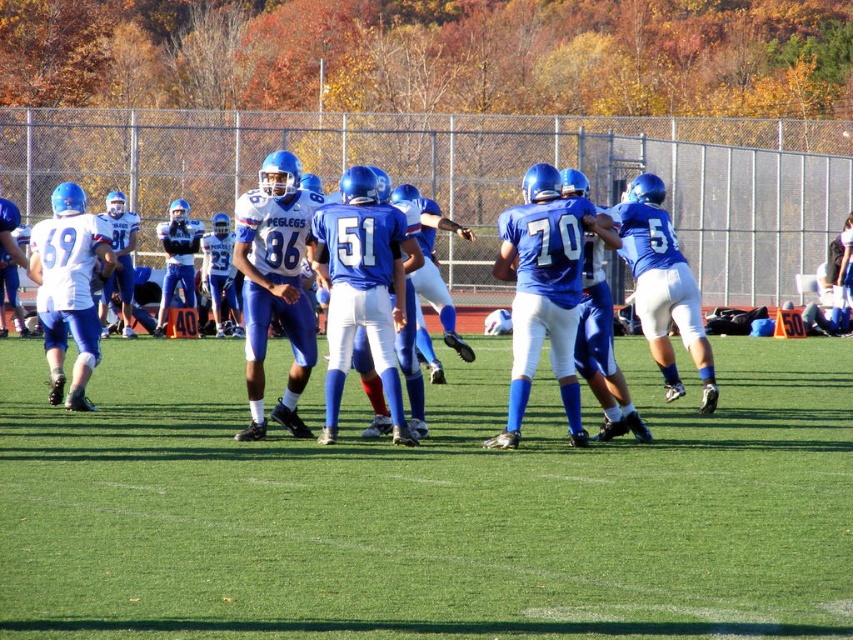
Looking at this image, which of these two, green artificial turf at center or blue matte uniform at center, stands taller?

blue matte uniform at center

Is green artificial turf at center thinner than blue matte uniform at center?

Incorrect, green artificial turf at center's width is not less than blue matte uniform at center's.

I want to click on green artificial turf at center, so click(x=427, y=508).